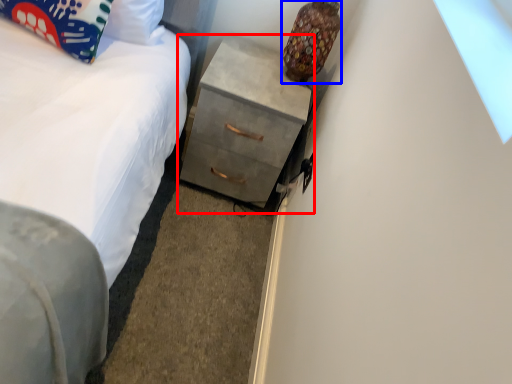
Question: Which object appears farthest to the camera in this image, chest of drawers (highlighted by a red box) or lamp (highlighted by a blue box)?

Choices:
 (A) chest of drawers
 (B) lamp

Answer: (A)